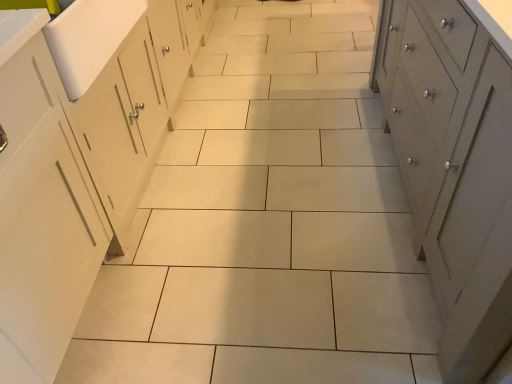
The image size is (512, 384). Describe the element at coordinates (89, 39) in the screenshot. I see `white glossy sink at left` at that location.

Identify the location of white glossy sink at left. The image size is (512, 384). (89, 39).

What is the approximate width of white glossy sink at left?

white glossy sink at left is 20.31 inches wide.

Find the location of a particular element. This screenshot has width=512, height=384. white painted wood cabinet at right is located at coordinates (453, 167).

Measure the distance between point (450,70) and camera.

Result: Point (450,70) is 4.01 feet away from camera.

Describe the element at coordinates (453, 167) in the screenshot. This screenshot has height=384, width=512. I see `white painted wood cabinet at right` at that location.

Find the location of a particular element. The image size is (512, 384). white glossy sink at left is located at coordinates (89, 39).

Which is more to the right, white painted wood cabinet at right or white glossy sink at left?

white painted wood cabinet at right is more to the right.

Which object is further away from the camera taking this photo, white painted wood cabinet at right or white glossy sink at left?

white glossy sink at left.

Is point (505, 149) farther from viewer compared to point (132, 20)?

That is False.

Based on the photo, from the image's perspective, which is below, white painted wood cabinet at right or white glossy sink at left?

white painted wood cabinet at right appears lower in the image.

From a real-world perspective, is white painted wood cabinet at right above or below white glossy sink at left?

In terms of real-world spatial position, white painted wood cabinet at right is below white glossy sink at left.

Considering the sizes of white painted wood cabinet at right and white glossy sink at left in the image, is white painted wood cabinet at right wider or thinner than white glossy sink at left?

Clearly, white painted wood cabinet at right has more width compared to white glossy sink at left.

Between white painted wood cabinet at right and white glossy sink at left, which one has more height?

white painted wood cabinet at right.

Considering the sizes of objects white painted wood cabinet at right and white glossy sink at left in the image provided, who is bigger, white painted wood cabinet at right or white glossy sink at left?

white painted wood cabinet at right.

Looking at this image, which is correct: white painted wood cabinet at right is inside white glossy sink at left, or outside of it?

white painted wood cabinet at right cannot be found inside white glossy sink at left.

Are white painted wood cabinet at right and white glossy sink at left making contact?

white painted wood cabinet at right and white glossy sink at left are clearly separated.

Could you tell me if white painted wood cabinet at right is facing white glossy sink at left?

No, white painted wood cabinet at right is not facing towards white glossy sink at left.

Can you tell me how much white painted wood cabinet at right and white glossy sink at left differ in facing direction?

They differ by 0.273 degrees in their facing directions.

The width and height of the screenshot is (512, 384). Identify the location of sink that appears on the left of white painted wood cabinet at right. (89, 39).

Which is more to the left, white glossy sink at left or white painted wood cabinet at right?

Positioned to the left is white glossy sink at left.

Which object is closer to the camera taking this photo, white glossy sink at left or white painted wood cabinet at right?

white painted wood cabinet at right is in front.

Is point (70, 35) positioned behind point (483, 254)?

Yes, point (70, 35) is behind point (483, 254).

From the image's perspective, between white glossy sink at left and white painted wood cabinet at right, which one is located above?

white glossy sink at left.

From a real-world perspective, is white glossy sink at left positioned under white painted wood cabinet at right based on gravity?

Actually, white glossy sink at left is physically above white painted wood cabinet at right in the real world.

Can you confirm if white glossy sink at left is thinner than white painted wood cabinet at right?

Correct, the width of white glossy sink at left is less than that of white painted wood cabinet at right.

Can you confirm if white glossy sink at left is taller than white painted wood cabinet at right?

No, white glossy sink at left is not taller than white painted wood cabinet at right.

Does white glossy sink at left have a smaller size compared to white painted wood cabinet at right?

Yes.

Would you say white glossy sink at left is inside or outside white painted wood cabinet at right?

white glossy sink at left cannot be found inside white painted wood cabinet at right.

Is white glossy sink at left far from white painted wood cabinet at right?

That's right, there is a large distance between white glossy sink at left and white painted wood cabinet at right.

Is white glossy sink at left positioned with its back to white painted wood cabinet at right?

white glossy sink at left is not turned away from white painted wood cabinet at right.

How different are the orientations of white glossy sink at left and white painted wood cabinet at right in degrees?

0.273 degrees.

Locate an element on the screen. The width and height of the screenshot is (512, 384). sink above the white painted wood cabinet at right (from the image's perspective) is located at coordinates (89, 39).

Find the location of a particular element. The width and height of the screenshot is (512, 384). sink that appears above the white painted wood cabinet at right (from a real-world perspective) is located at coordinates (89, 39).

You are a GUI agent. You are given a task and a screenshot of the screen. Output one action in this format:
    pyautogui.click(x=<x>, y=<y>)
    Task: Click on the cupboard on the right of the white glossy sink at left
    The height and width of the screenshot is (384, 512).
    Given the screenshot: What is the action you would take?
    pyautogui.click(x=453, y=167)